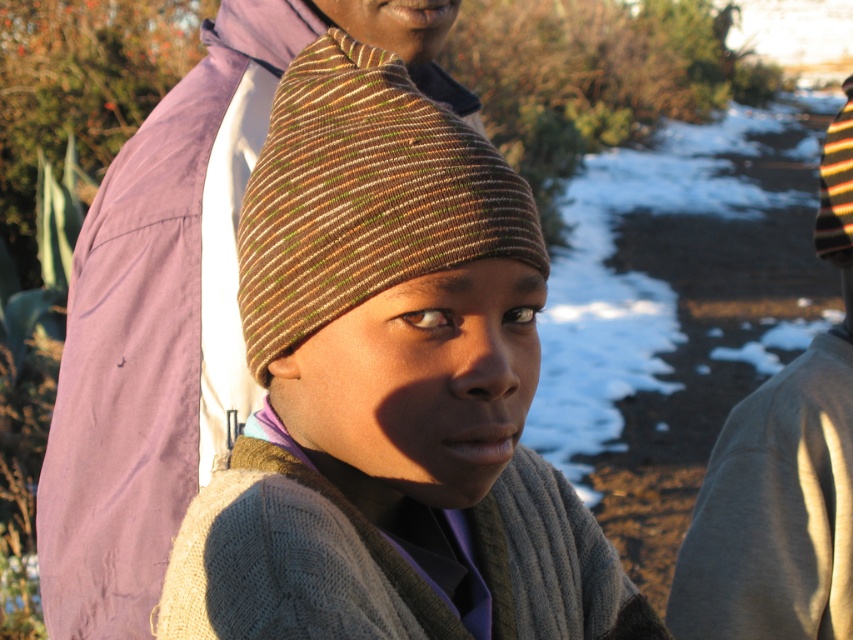
Question: Which object is the farthest from the white powdery snow at center?

Choices:
 (A) knitted brown beanie at center
 (B) gray cotton sweater at right
 (C) striped knit beanie at center

Answer: (B)

Question: Which point is closer to the camera?

Choices:
 (A) (825, 148)
 (B) (412, 136)

Answer: (B)

Question: Considering the relative positions of striped knit beanie at center and gray cotton sweater at right in the image provided, where is striped knit beanie at center located with respect to gray cotton sweater at right?

Choices:
 (A) below
 (B) above

Answer: (B)

Question: In this image, where is white powdery snow at center located relative to gray cotton sweater at right?

Choices:
 (A) right
 (B) left

Answer: (A)

Question: Can you confirm if knitted brown beanie at center is bigger than striped knit beanie at center?

Choices:
 (A) no
 (B) yes

Answer: (B)

Question: Among these points, which one is nearest to the camera?

Choices:
 (A) (750, 310)
 (B) (276, 198)

Answer: (B)